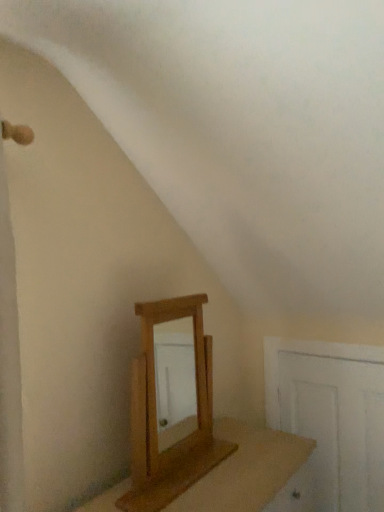
I want to click on vacant space underneath light brown wooden mirror at center (from a real-world perspective), so click(189, 470).